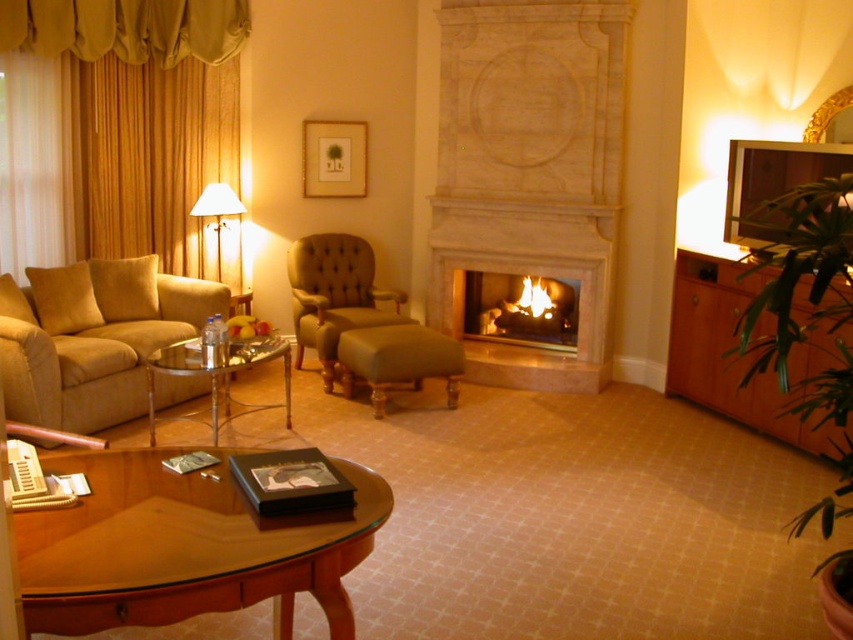
You are standing in the living room and need to place a new rug. The rug will be placed at coordinates point 0.5, 0.1. Will the matte gold couch at left be directly on top of the rug?

The matte gold couch at left is positioned at point (91, 337), which is very close to the rug at (84, 320). However, since the coordinates are not exactly the same, the couch will not be directly on top of the rug but will be nearby.

You are a guest in the living room and want to place a tall decorative vase on the tallest object in the room. Which object should you choose between the matte gold couch at left and the matte wood picture frame at upper center?

The matte gold couch at left is much taller than the matte wood picture frame at upper center, so you should place the vase on the matte gold couch at left.